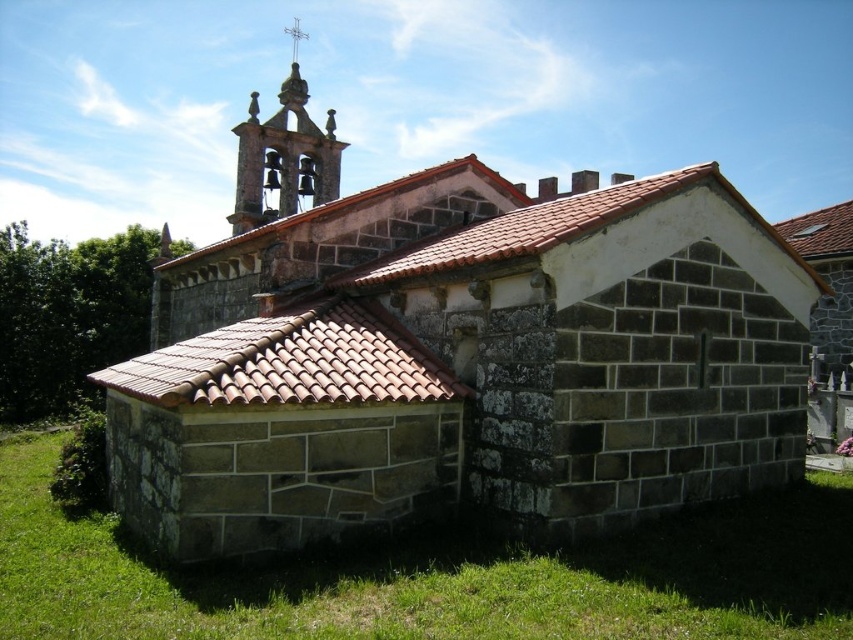
You are a gardener planning to plant flowers along the edge of the green grass at lower center and the brown tile roof at lower left. Which area has more space available for planting?

The brown tile roof at lower left has more space available for planting because it is larger than the green grass at lower center.